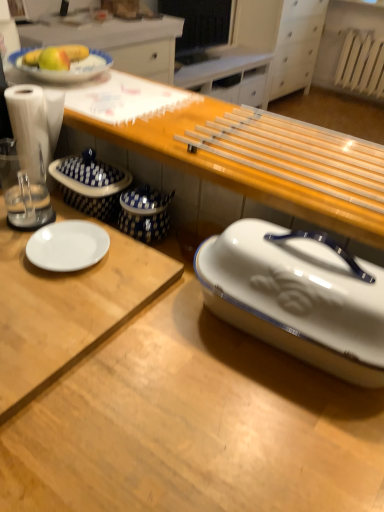
Find the location of a particular element. spots to the right of yellow matte apple at upper left is located at coordinates (118, 88).